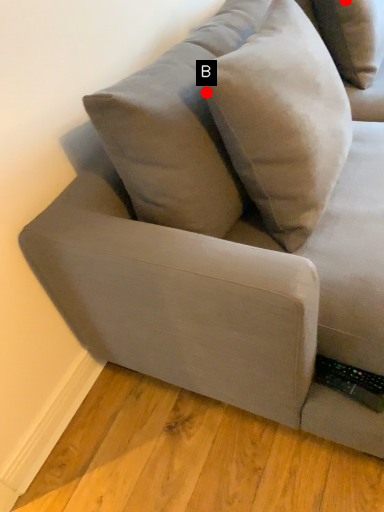
Question: Two points are circled on the image, labeled by A and B beside each circle. Which point is closer to the camera?

Choices:
 (A) A is closer
 (B) B is closer

Answer: (B)